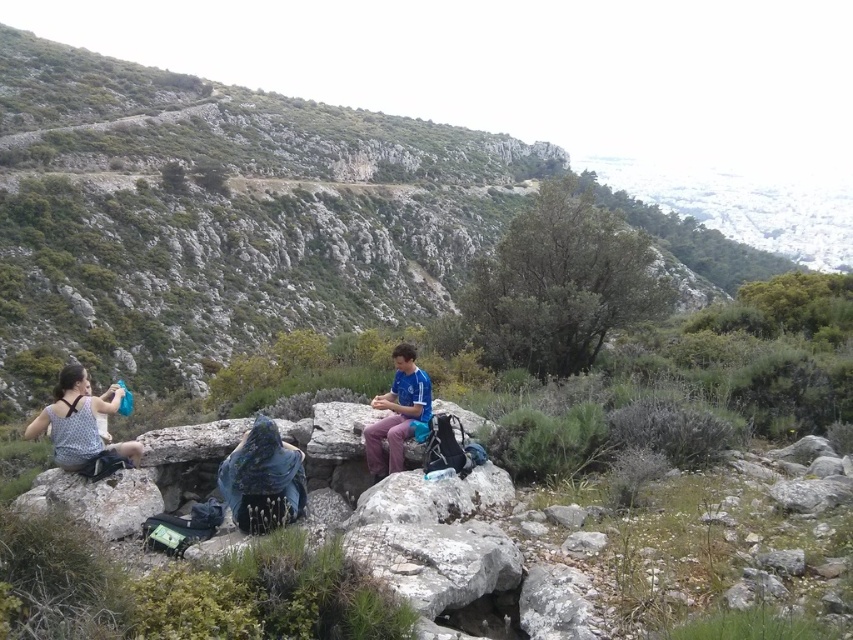
Question: Is polka dot fabric backpack at lower left thinner than blue jersey at center?

Choices:
 (A) no
 (B) yes

Answer: (A)

Question: Does polka dot fabric backpack at lower left appear under blue jersey at center?

Choices:
 (A) no
 (B) yes

Answer: (B)

Question: Which of the following is the closest to the observer?

Choices:
 (A) polka dot fabric backpack at lower left
 (B) blue jersey at center

Answer: (A)

Question: Which of the following is the farthest from the observer?

Choices:
 (A) polka dot fabric backpack at lower left
 (B) blue jersey at center

Answer: (B)

Question: Which object appears closest to the camera in this image?

Choices:
 (A) blue jersey at center
 (B) polka dot fabric backpack at lower left

Answer: (B)

Question: Does polka dot fabric backpack at lower left have a larger size compared to blue jersey at center?

Choices:
 (A) no
 (B) yes

Answer: (B)